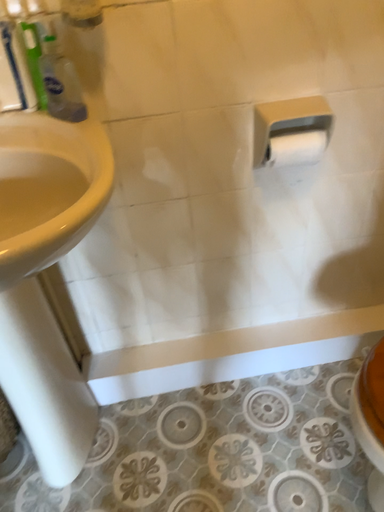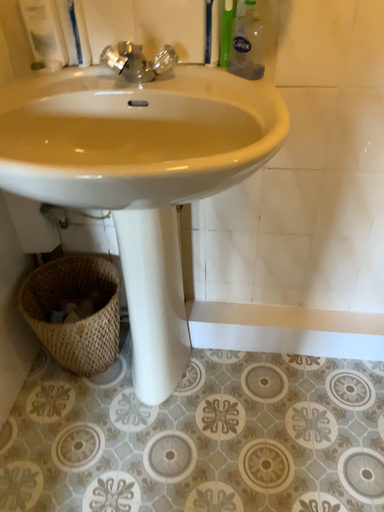
Question: Which way did the camera rotate in the video?

Choices:
 (A) rotated left
 (B) rotated right

Answer: (A)